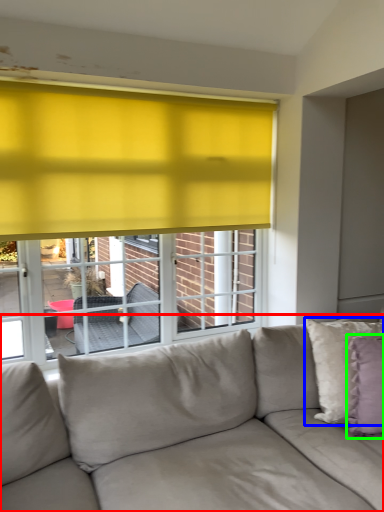
Question: Which object is positioned farthest from studio couch (highlighted by a red box)? Select from pillow (highlighted by a blue box) and pillow (highlighted by a green box).

Choices:
 (A) pillow
 (B) pillow

Answer: (B)